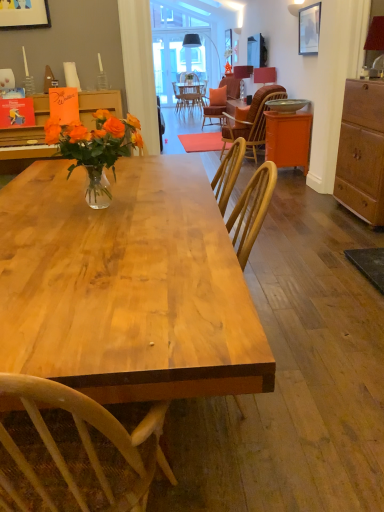
The height and width of the screenshot is (512, 384). I want to click on matte black picture frame at upper right, so click(309, 29).

Image resolution: width=384 pixels, height=512 pixels. Describe the element at coordinates (375, 45) in the screenshot. I see `matte red lampshade at upper right, the 3th lamp viewed from the top` at that location.

Identify the location of wooden cabinet at right. (362, 151).

Locate an element on the screen. Image resolution: width=384 pixels, height=512 pixels. orange matte cabinet at right is located at coordinates (288, 139).

Does matte black picture frame at upper right turn towards wooden wicker chair at center?

No, matte black picture frame at upper right does not turn towards wooden wicker chair at center.

Considering the relative sizes of matte black picture frame at upper right and wooden wicker chair at center in the image provided, is matte black picture frame at upper right shorter than wooden wicker chair at center?

Yes, matte black picture frame at upper right is shorter than wooden wicker chair at center.

From the image's perspective, is matte black picture frame at upper right beneath wooden wicker chair at center?

Incorrect, from the image's perspective, matte black picture frame at upper right is higher than wooden wicker chair at center.

Is matte black picture frame at upper right positioned in front of wooden wicker chair at center?

Yes, matte black picture frame at upper right is closer to the viewer.

Considering the sizes of objects wooden wicker chair at center and orange matte cabinet at right in the image provided, who is thinner, wooden wicker chair at center or orange matte cabinet at right?

Thinner between the two is orange matte cabinet at right.

Between wooden wicker chair at center and orange matte cabinet at right, which one has smaller size?

orange matte cabinet at right is smaller.

Which of these two, wooden wicker chair at center or orange matte cabinet at right, stands shorter?

orange matte cabinet at right is shorter.

Locate an element on the screen. The height and width of the screenshot is (512, 384). table that appears on the right of wooden wicker chair at center is located at coordinates (288, 139).

Considering the relative sizes of matte red lampshade at upper right, which is the second lamp from right to left, and wooden wicker chair at center in the image provided, is matte red lampshade at upper right, which is the second lamp from right to left, smaller than wooden wicker chair at center?

Yes.

Where is `the 2nd lamp to the right of the wooden wicker chair at center, starting your count from the anchor`? The height and width of the screenshot is (512, 384). the 2nd lamp to the right of the wooden wicker chair at center, starting your count from the anchor is located at coordinates (264, 75).

Is matte red lampshade at upper right, which is counted as the 2th lamp, starting from the bottom, facing away from wooden wicker chair at center?

No, matte red lampshade at upper right, which is counted as the 2th lamp, starting from the bottom, is not facing away from wooden wicker chair at center.

Considering the relative sizes of matte black lampshade at upper center, acting as the 1th lamp starting from the left, and matte red lampshade at upper right, the 1th lamp when ordered from bottom to top, in the image provided, is matte black lampshade at upper center, acting as the 1th lamp starting from the left, thinner than matte red lampshade at upper right, the 1th lamp when ordered from bottom to top,?

Incorrect, the width of matte black lampshade at upper center, acting as the 1th lamp starting from the left, is not less than that of matte red lampshade at upper right, the 1th lamp when ordered from bottom to top.

Considering the positions of objects matte black lampshade at upper center, which ranks as the third lamp in bottom-to-top order, and matte red lampshade at upper right, acting as the third lamp starting from the left, in the image provided, who is more to the left, matte black lampshade at upper center, which ranks as the third lamp in bottom-to-top order, or matte red lampshade at upper right, acting as the third lamp starting from the left,?

matte black lampshade at upper center, which ranks as the third lamp in bottom-to-top order.

In the scene shown: Is matte black lampshade at upper center, acting as the 1th lamp starting from the left, positioned far away from matte red lampshade at upper right, the 1th lamp when ordered from bottom to top?

Yes, matte black lampshade at upper center, acting as the 1th lamp starting from the left, and matte red lampshade at upper right, the 1th lamp when ordered from bottom to top, are quite far apart.

Based on the photo, from their relative heights in the image, would you say matte black lampshade at upper center, placed as the first lamp when sorted from back to front, is taller or shorter than matte red lampshade at upper right, the 1th lamp when ordered from bottom to top?

Considering their sizes, matte black lampshade at upper center, placed as the first lamp when sorted from back to front, has more height than matte red lampshade at upper right, the 1th lamp when ordered from bottom to top.

The height and width of the screenshot is (512, 384). I want to click on table behind the matte red lampshade at upper right, acting as the third lamp starting from the left, so click(288, 139).

Is matte red lampshade at upper right, the first lamp positioned from the front, completely or partially outside of orange matte cabinet at right?

Yes, matte red lampshade at upper right, the first lamp positioned from the front, is not within orange matte cabinet at right.

Does matte red lampshade at upper right, the 3th lamp viewed from the top, come behind orange matte cabinet at right?

No, matte red lampshade at upper right, the 3th lamp viewed from the top, is in front of orange matte cabinet at right.

Is matte red lampshade at upper right, the first lamp positioned from the front, thinner than orange matte cabinet at right?

Correct, the width of matte red lampshade at upper right, the first lamp positioned from the front, is less than that of orange matte cabinet at right.

Would you consider wooden wicker chair at center to be distant from natural wood table at center?

Yes.

The width and height of the screenshot is (384, 512). Find the location of `desk in front of the wooden wicker chair at center`. desk in front of the wooden wicker chair at center is located at coordinates (127, 286).

Can we say wooden wicker chair at center lies outside natural wood table at center?

wooden wicker chair at center lies outside natural wood table at center's area.

From the image's perspective, is wooden wicker chair at center below natural wood table at center?

No.

Based on the photo, considering the relative sizes of orange glass vase at center and wooden wicker chair at center in the image provided, is orange glass vase at center bigger than wooden wicker chair at center?

No.

I want to click on floral arrangement that appears above the wooden wicker chair at center (from a real-world perspective), so click(95, 149).

Considering the relative positions of orange glass vase at center and wooden wicker chair at center in the image provided, is orange glass vase at center in front of wooden wicker chair at center?

That is True.

Locate an element on the screen. picture frame above the wooden wicker chair at center (from a real-world perspective) is located at coordinates (309, 29).

I want to click on chair on the left of orange matte cabinet at right, so point(252,120).

Considering their positions, is matte black lampshade at upper center, placed as the first lamp when sorted from back to front, positioned closer to wooden cabinet at right than matte red lampshade at upper right, which is the second lamp from front to back?

matte red lampshade at upper right, which is the second lamp from front to back, lies closer to wooden cabinet at right than the other object.

Which object lies further to the anchor point matte black picture frame at upper right, wooden cabinet at right or natural wood table at center?

natural wood table at center lies further to matte black picture frame at upper right than the other object.

Which object lies further to the anchor point matte red lampshade at upper right, the 3th lamp viewed from the top, matte black lampshade at upper center, acting as the 1th lamp starting from the left, or orange glass vase at center?

orange glass vase at center is further to matte red lampshade at upper right, the 3th lamp viewed from the top.

Looking at the image, which one is located closer to wooden cabinet at right, matte red lampshade at upper right, which is the second lamp from front to back, or matte red lampshade at upper right, the 1th lamp when ordered from bottom to top?

matte red lampshade at upper right, the 1th lamp when ordered from bottom to top, is positioned closer to the anchor wooden cabinet at right.

From the image, which object appears to be farther from orange glass vase at center, wooden wicker chair at center or matte black lampshade at upper center, placed as the first lamp when sorted from back to front?

Based on the image, matte black lampshade at upper center, placed as the first lamp when sorted from back to front, appears to be further to orange glass vase at center.

Which object lies further to the anchor point natural wood table at center, orange matte cabinet at right or matte black lampshade at upper center, which appears as the 3th lamp when viewed from the right?

The object further to natural wood table at center is matte black lampshade at upper center, which appears as the 3th lamp when viewed from the right.

Which object lies further to the anchor point wooden cabinet at right, wooden wicker chair at center or matte black lampshade at upper center, acting as the 1th lamp starting from the top?

The object further to wooden cabinet at right is matte black lampshade at upper center, acting as the 1th lamp starting from the top.

When comparing their distances from wooden wicker chair at center, does natural wood table at center or orange matte cabinet at right seem closer?

orange matte cabinet at right lies closer to wooden wicker chair at center than the other object.

At what (x,y) coordinates should I click in order to perform the action: click on picture frame positioned between orange glass vase at center and wooden wicker chair at center from near to far. Please return your answer as a coordinate pair (x, y). This screenshot has height=512, width=384. Looking at the image, I should click on (309, 29).

Locate an element on the screen. The image size is (384, 512). floral arrangement located between natural wood table at center and wooden wicker chair at center in the depth direction is located at coordinates (95, 149).

This screenshot has width=384, height=512. In order to click on table positioned between natural wood table at center and matte black lampshade at upper center, acting as the 1th lamp starting from the top, from near to far in this screenshot , I will do `click(288, 139)`.

Locate an element on the screen. The width and height of the screenshot is (384, 512). table between wooden cabinet at right and matte red lampshade at upper right, which is the 2th lamp from back to front, from front to back is located at coordinates (288, 139).